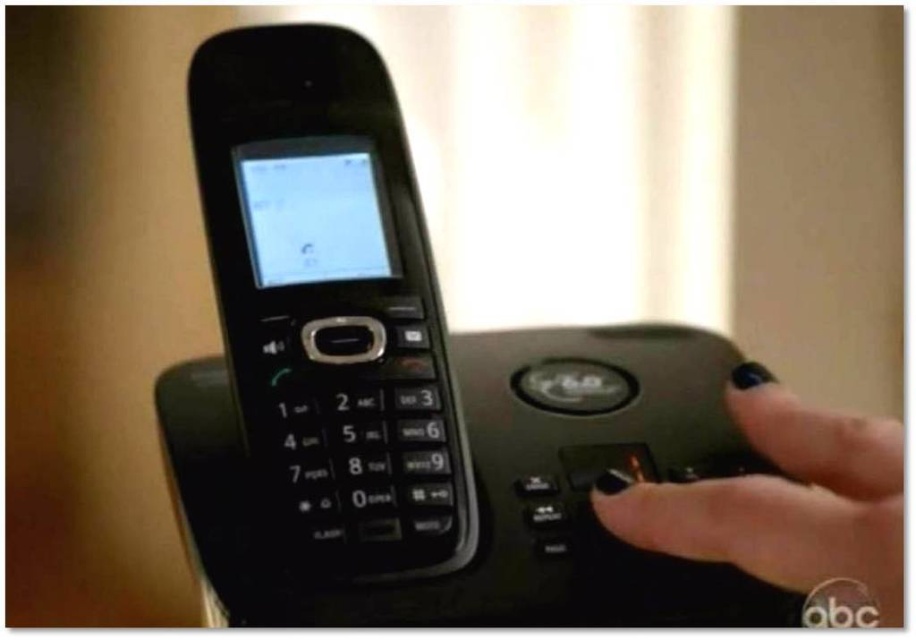
Based on the photo, you are holding a black polished nail at right and want to place it on the black plastic phone at center. Can you reach it without moving your hand?

The black plastic phone at center is further to the viewer than the black polished nail at right, so you can easily reach it without moving your hand.

You are trying to locate the black plastic phone at center on a desk. According to the coordinates provided, where exactly is it positioned?

The black plastic phone at center is located at point coordinates of 0.473 on the x axis and 0.360 on the y axis.